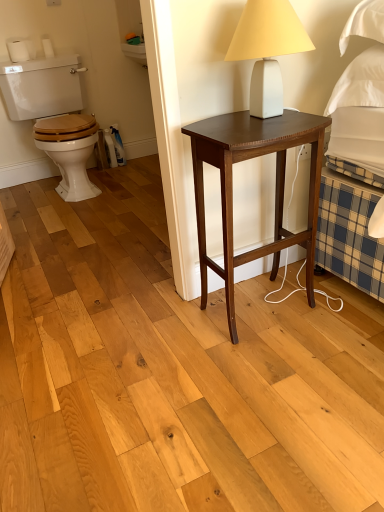
Where is `empty space that is ontop of dark wood nightstand at center`? The height and width of the screenshot is (512, 384). empty space that is ontop of dark wood nightstand at center is located at coordinates (267, 122).